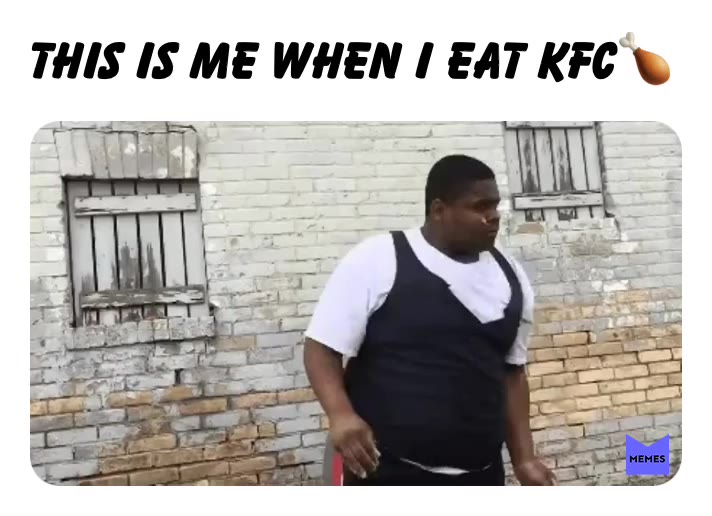
This screenshot has width=712, height=516. I want to click on brick wall, so click(x=638, y=361).